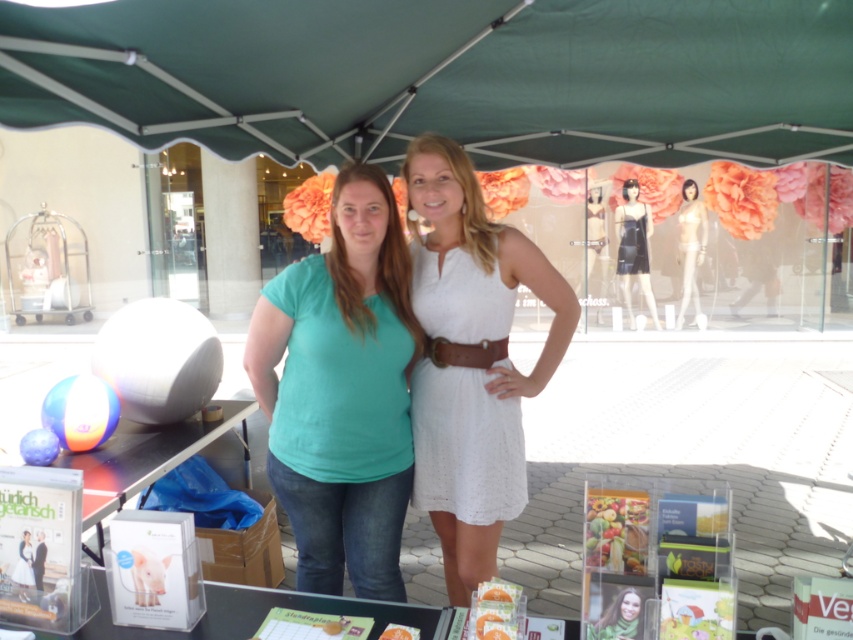
Which is in front, point (479, 234) or point (242, 634)?

Point (242, 634) is more forward.

Is white lace dress at center thinner than clear plastic table at center?

Yes.

Does point (415, 154) come behind point (88, 620)?

Yes, point (415, 154) is behind point (88, 620).

At what (x,y) coordinates should I click in order to perform the action: click on white lace dress at center. Please return your answer as a coordinate pair (x, y). The width and height of the screenshot is (853, 640). Looking at the image, I should click on (468, 368).

Is teal matte t-shirt at center above black satin dress at upper center?

Actually, teal matte t-shirt at center is below black satin dress at upper center.

Which of these two, teal matte t-shirt at center or black satin dress at upper center, stands taller?

black satin dress at upper center is taller.

Locate an element on the screen. The image size is (853, 640). teal matte t-shirt at center is located at coordinates (341, 392).

At what (x,y) coordinates should I click in order to perform the action: click on teal matte t-shirt at center. Please return your answer as a coordinate pair (x, y). This screenshot has height=640, width=853. Looking at the image, I should click on (341, 392).

In the scene shown: Who is positioned more to the left, teal matte t-shirt at center or brown leather belt at center?

From the viewer's perspective, teal matte t-shirt at center appears more on the left side.

The height and width of the screenshot is (640, 853). What are the coordinates of `teal matte t-shirt at center` in the screenshot? It's located at (341, 392).